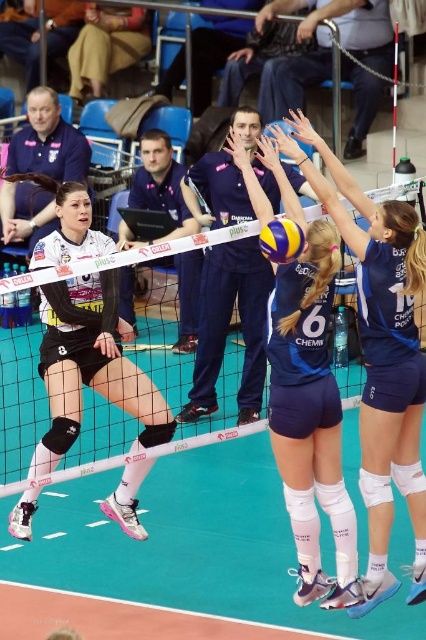
Question: Which of these objects is positioned farthest from the yellow matte volleyball at center?

Choices:
 (A) white mesh net at center
 (B) blue fabric shorts at center
 (C) matte black uniform at center

Answer: (A)

Question: Is the position of blue fabric volleyball at center more distant than that of matte black uniform at center?

Choices:
 (A) yes
 (B) no

Answer: (B)

Question: Is blue fabric volleyball at center smaller than matte black uniform at center?

Choices:
 (A) yes
 (B) no

Answer: (A)

Question: Among these objects, which one is farthest from the camera?

Choices:
 (A) matte black uniform at center
 (B) blue fabric volleyball at center

Answer: (A)

Question: Which point is closer to the camera taking this photo?

Choices:
 (A) (45, 305)
 (B) (273, 230)
 (C) (74, 449)
 (D) (291, 353)

Answer: (B)

Question: Does blue fabric shorts at center come behind blue fabric volleyball at center?

Choices:
 (A) no
 (B) yes

Answer: (B)